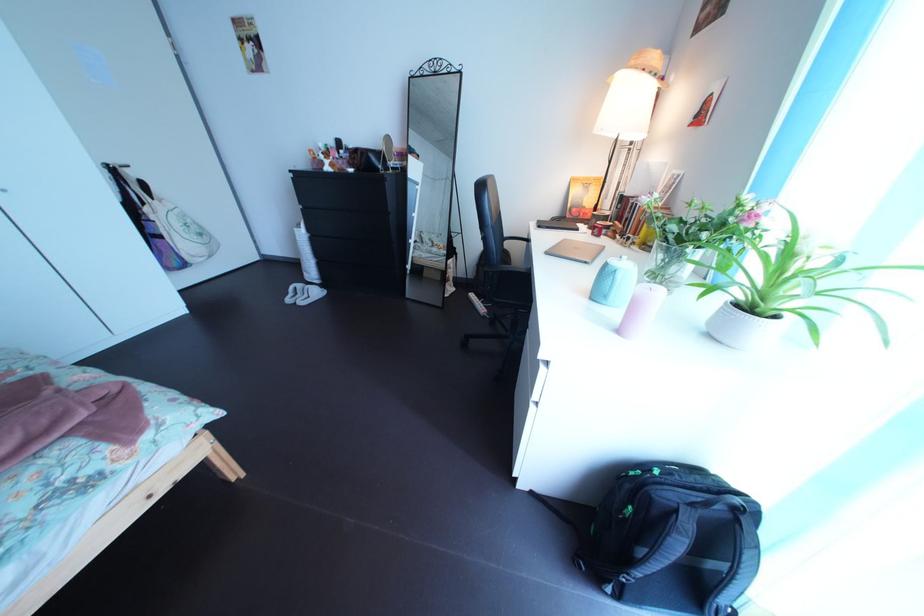
Where is `white plant pot`? white plant pot is located at coordinates (744, 328).